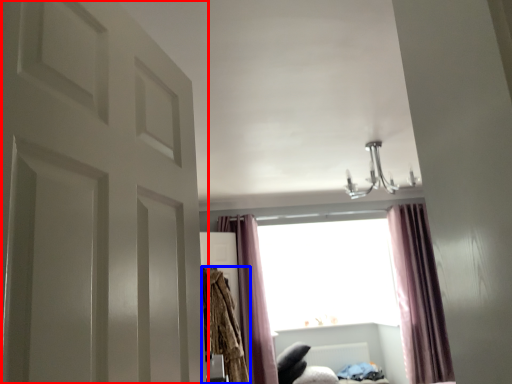
Question: Which of the following is the farthest to the observer, door (highlighted by a red box) or robe (highlighted by a blue box)?

Choices:
 (A) door
 (B) robe

Answer: (B)